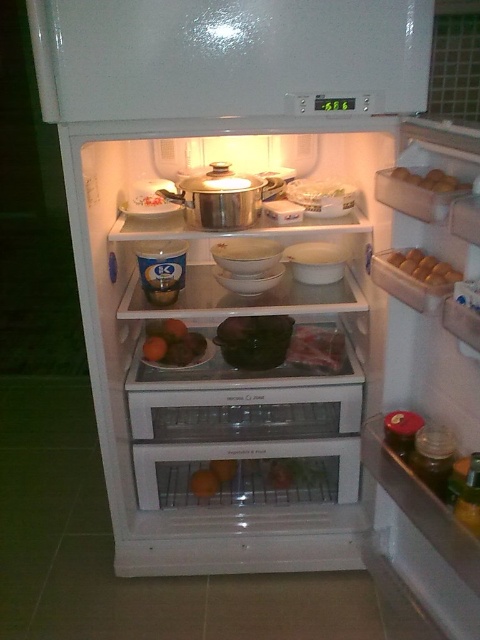
Where is `orange matte at center`? This screenshot has height=640, width=480. orange matte at center is located at coordinates (172, 342).

Between orange matte at center and brown egg carton at upper right, which one has less height?

brown egg carton at upper right is shorter.

Is point (175, 321) behind point (408, 173)?

Yes.

I want to click on orange matte at center, so click(172, 342).

Is green matte vegetable at center below orange matte at center?

Correct, green matte vegetable at center is located below orange matte at center.

Does green matte vegetable at center have a larger size compared to orange matte at center?

Incorrect, green matte vegetable at center is not larger than orange matte at center.

Is point (260, 339) positioned in front of point (153, 348)?

Yes, it is in front of point (153, 348).

Where is `green matte vegetable at center`? green matte vegetable at center is located at coordinates (254, 340).

From the picture: Is the position of brown matte eggs at upper right more distant than that of brown egg carton at upper right?

Yes, it is.

Looking at this image, who is positioned more to the right, brown matte eggs at upper right or brown egg carton at upper right?

From the viewer's perspective, brown matte eggs at upper right appears more on the right side.

Does point (434, 275) come farther from viewer compared to point (423, 180)?

That is False.

Where is `brown matte eggs at upper right`? This screenshot has height=640, width=480. brown matte eggs at upper right is located at coordinates (424, 268).